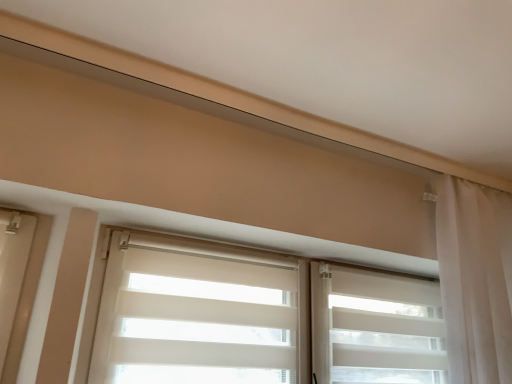
Question: Does white sheer curtain at right have a lesser height compared to white sheer curtain at center?

Choices:
 (A) yes
 (B) no

Answer: (B)

Question: Does white sheer curtain at right come in front of white sheer curtain at center?

Choices:
 (A) no
 (B) yes

Answer: (A)

Question: Is white sheer curtain at right not within white sheer curtain at center?

Choices:
 (A) yes
 (B) no

Answer: (A)

Question: Considering the relative sizes of white sheer curtain at right and white sheer curtain at center in the image provided, is white sheer curtain at right taller than white sheer curtain at center?

Choices:
 (A) no
 (B) yes

Answer: (B)

Question: Is white sheer curtain at right next to white sheer curtain at center and touching it?

Choices:
 (A) yes
 (B) no

Answer: (B)

Question: Is white sheer curtain at center bigger or smaller than white sheer curtain at right?

Choices:
 (A) small
 (B) big

Answer: (A)

Question: Looking at their shapes, would you say white sheer curtain at center is wider or thinner than white sheer curtain at right?

Choices:
 (A) wide
 (B) thin

Answer: (B)

Question: From a real-world perspective, relative to white sheer curtain at right, is white sheer curtain at center vertically above or below?

Choices:
 (A) below
 (B) above

Answer: (A)

Question: Is white sheer curtain at center inside the boundaries of white sheer curtain at right, or outside?

Choices:
 (A) outside
 (B) inside

Answer: (A)

Question: Visually, is white matte/soft roller-shutter at center positioned to the left or to the right of white sheer curtain at center?

Choices:
 (A) right
 (B) left

Answer: (A)

Question: From their relative heights in the image, would you say white matte/soft roller-shutter at center is taller or shorter than white sheer curtain at center?

Choices:
 (A) tall
 (B) short

Answer: (B)

Question: From the image's perspective, is white matte/soft roller-shutter at center positioned above or below white sheer curtain at center?

Choices:
 (A) above
 (B) below

Answer: (B)

Question: Considering the positions of white matte/soft roller-shutter at center and white sheer curtain at center in the image, is white matte/soft roller-shutter at center wider or thinner than white sheer curtain at center?

Choices:
 (A) thin
 (B) wide

Answer: (B)

Question: Considering the positions of point (311, 334) and point (480, 225), is point (311, 334) closer or farther from the camera than point (480, 225)?

Choices:
 (A) farther
 (B) closer

Answer: (B)

Question: From the image's perspective, is white matte/soft roller-shutter at center located above or below white sheer curtain at right?

Choices:
 (A) above
 (B) below

Answer: (B)